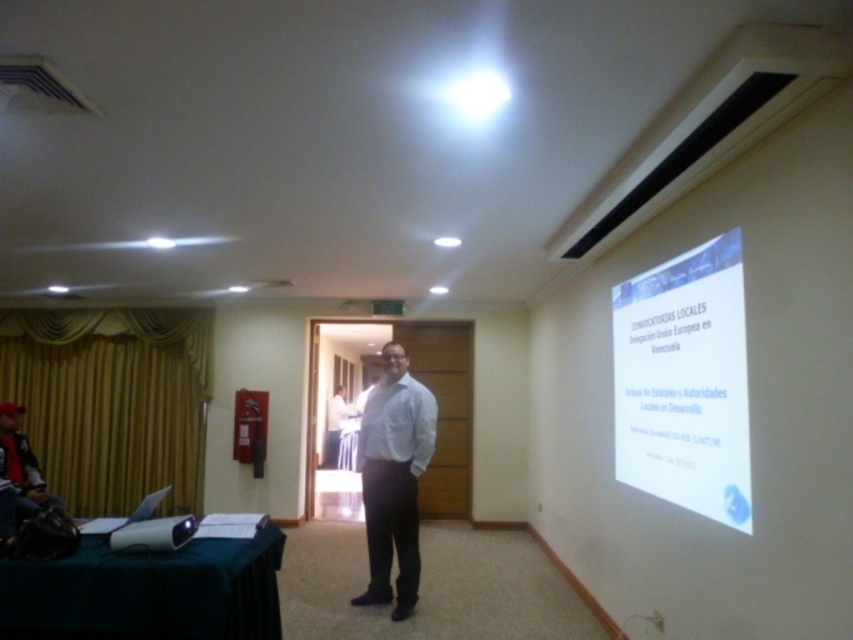
Who is taller, white matte projector screen at upper right or white matte shirt at center?

With more height is white matte shirt at center.

From the picture: Is white matte projector screen at upper right taller than white matte shirt at center?

In fact, white matte projector screen at upper right may be shorter than white matte shirt at center.

Is point (729, 328) positioned after point (393, 504)?

No.

The image size is (853, 640). I want to click on white matte projector screen at upper right, so click(x=683, y=381).

Does white matte shirt at center come behind dark gray jacket at left?

Yes, it is.

Does white matte shirt at center have a larger size compared to dark gray jacket at left?

Actually, white matte shirt at center might be smaller than dark gray jacket at left.

This screenshot has height=640, width=853. Describe the element at coordinates (393, 477) in the screenshot. I see `white matte shirt at center` at that location.

Find the location of `white matte shirt at center`. white matte shirt at center is located at coordinates (393, 477).

Is white matte projector screen at upper right above dark gray jacket at left?

Yes.

Is the position of white matte projector screen at upper right more distant than that of dark gray jacket at left?

That is False.

Locate an element on the screen. The height and width of the screenshot is (640, 853). white matte projector screen at upper right is located at coordinates (683, 381).